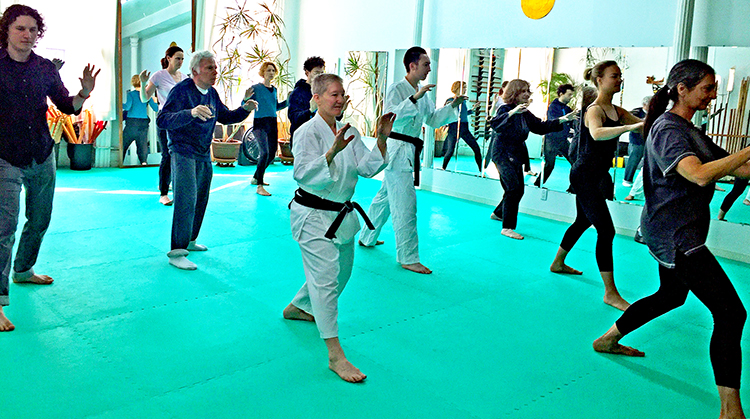
I want to click on green floor mats, so click(158, 346).